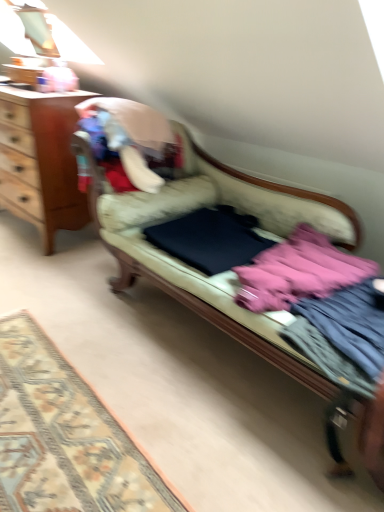
Locate an element on the screen. The width and height of the screenshot is (384, 512). free point below carpeted rug at lower left (from a real-world perspective) is located at coordinates (58, 443).